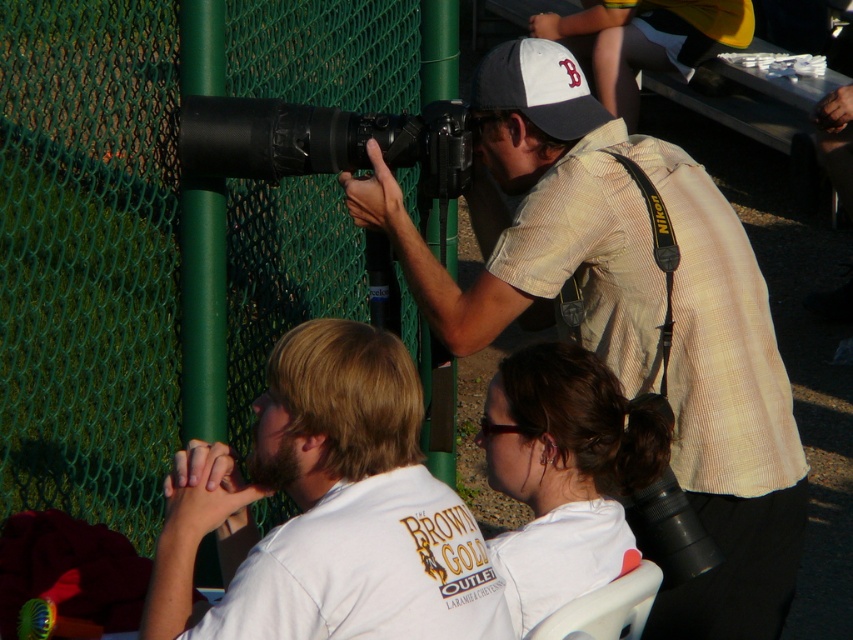
You are a photographer at the event and need to adjust your equipment. The white cotton shirt at center and the black matte camera at center are both in your line of sight. Which object is taller?

The white cotton shirt at center is taller than the black matte camera at center according to the description.

You are standing at the edge of the field and want to take a photo of the point at coordinates (326, 93). If your camera has a maximum focus range of 15 feet, will you be able to capture that point clearly?

The distance of point (326, 93) from viewer is 14.92 feet, which is within the camera maximum focus range of 15 feet. Therefore, you can capture that point clearly.